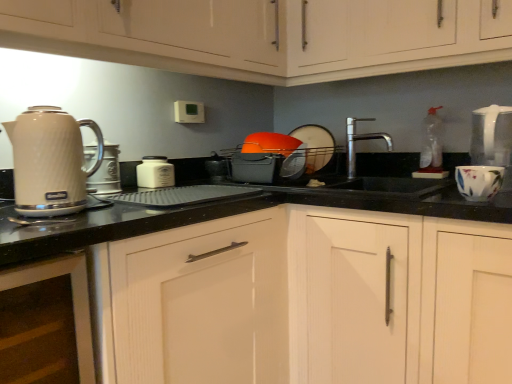
Question: From the image's perspective, is white wood cabinet at center, placed as the 1th cabinetry when sorted from bottom to top, on top of matte white cabinets at upper left, marked as the first cabinetry in a top-to-bottom arrangement?

Choices:
 (A) no
 (B) yes

Answer: (A)

Question: Considering the relative positions of white wood cabinet at center, placed as the 1th cabinetry when sorted from bottom to top, and matte white cabinets at upper left, the 4th cabinetry positioned from the bottom, in the image provided, is white wood cabinet at center, placed as the 1th cabinetry when sorted from bottom to top, to the right of matte white cabinets at upper left, the 4th cabinetry positioned from the bottom, from the viewer's perspective?

Choices:
 (A) yes
 (B) no

Answer: (A)

Question: Is white wood cabinet at center, placed as the 1th cabinetry when sorted from bottom to top, positioned in front of matte white cabinets at upper left, the 4th cabinetry positioned from the bottom?

Choices:
 (A) no
 (B) yes

Answer: (A)

Question: Does white wood cabinet at center, the 4th cabinetry when ordered from top to bottom, appear on the left side of matte white cabinets at upper left, the 4th cabinetry positioned from the bottom?

Choices:
 (A) no
 (B) yes

Answer: (A)

Question: Considering the relative sizes of white wood cabinet at center, the 4th cabinetry when ordered from top to bottom, and matte white cabinets at upper left, marked as the first cabinetry in a top-to-bottom arrangement, in the image provided, is white wood cabinet at center, the 4th cabinetry when ordered from top to bottom, wider than matte white cabinets at upper left, marked as the first cabinetry in a top-to-bottom arrangement,?

Choices:
 (A) no
 (B) yes

Answer: (B)

Question: In the image, is matte white kettle at left on the left side or the right side of polished stainless steel faucet at center?

Choices:
 (A) right
 (B) left

Answer: (B)

Question: From the image's perspective, is matte white kettle at left above or below polished stainless steel faucet at center?

Choices:
 (A) above
 (B) below

Answer: (B)

Question: In terms of size, does matte white kettle at left appear bigger or smaller than polished stainless steel faucet at center?

Choices:
 (A) big
 (B) small

Answer: (B)

Question: Does point (57, 188) appear closer or farther from the camera than point (353, 145)?

Choices:
 (A) farther
 (B) closer

Answer: (B)

Question: From a real-world perspective, is polished stainless steel faucet at center physically located above or below white wood cabinet at lower left, the second cabinetry in the bottom-to-top sequence?

Choices:
 (A) below
 (B) above

Answer: (B)

Question: In terms of height, does polished stainless steel faucet at center look taller or shorter compared to white wood cabinet at lower left, the second cabinetry in the bottom-to-top sequence?

Choices:
 (A) short
 (B) tall

Answer: (A)

Question: From the image's perspective, is polished stainless steel faucet at center above or below white wood cabinet at lower left, which is counted as the 3th cabinetry, starting from the top?

Choices:
 (A) below
 (B) above

Answer: (B)

Question: Would you say polished stainless steel faucet at center is inside or outside white wood cabinet at lower left, which is counted as the 3th cabinetry, starting from the top?

Choices:
 (A) outside
 (B) inside

Answer: (A)

Question: Looking at the image, does white wood cabinet at center, placed as the 1th cabinetry when sorted from bottom to top, seem bigger or smaller compared to matte white kettle at left?

Choices:
 (A) big
 (B) small

Answer: (A)

Question: Considering the positions of white wood cabinet at center, placed as the 1th cabinetry when sorted from bottom to top, and matte white kettle at left in the image, is white wood cabinet at center, placed as the 1th cabinetry when sorted from bottom to top, wider or thinner than matte white kettle at left?

Choices:
 (A) thin
 (B) wide

Answer: (B)